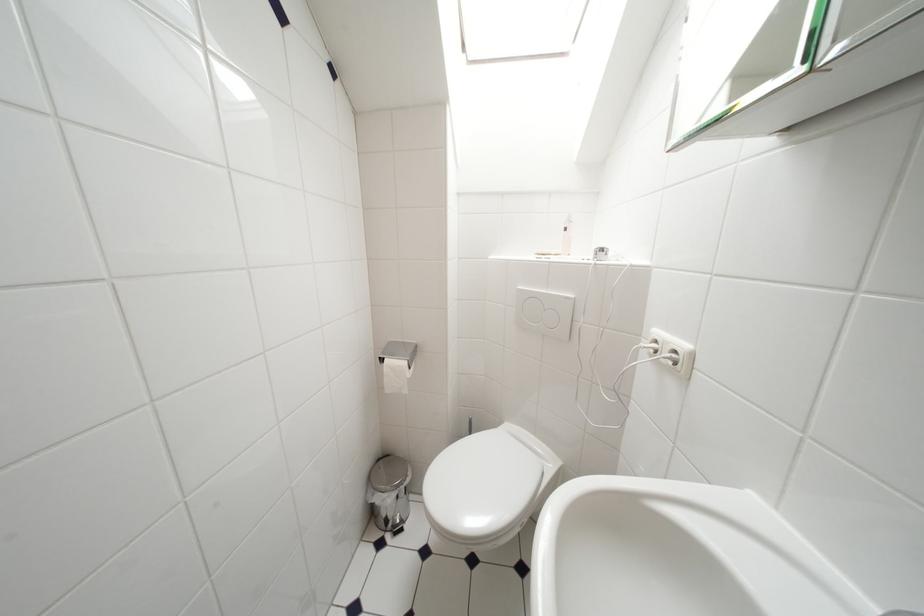
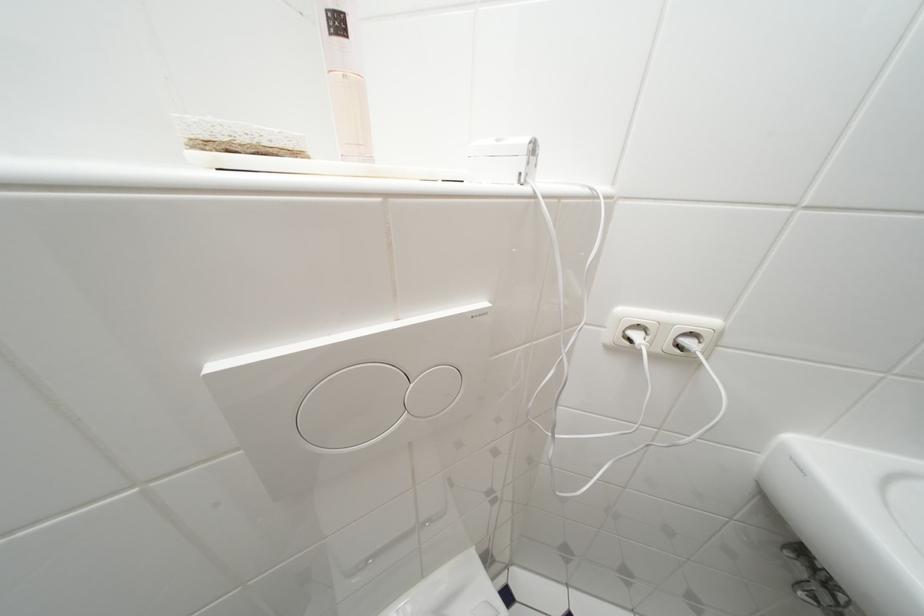
Where in the second image is the point corresponding to point 573,233 from the first image?

(345, 26)